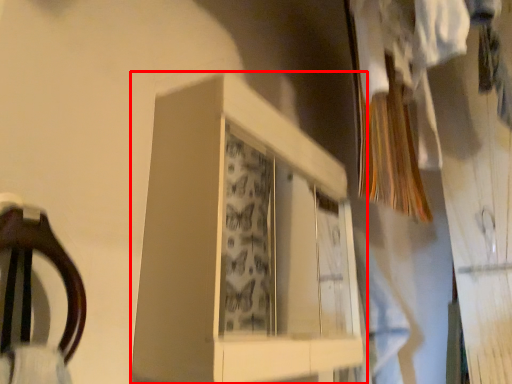
Question: From the image's perspective, where is cabinet (annotated by the red box) located relative to clothing?

Choices:
 (A) below
 (B) above

Answer: (B)